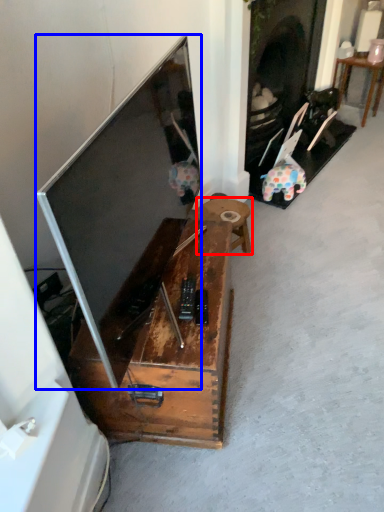
Question: Which object appears closest to the camera in this image, table (highlighted by a red box) or television (highlighted by a blue box)?

Choices:
 (A) table
 (B) television

Answer: (B)